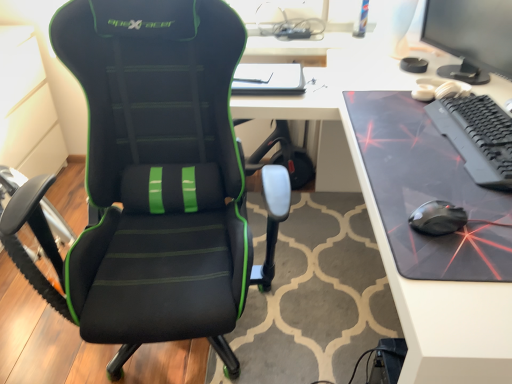
Question: Considering the relative sizes of black matte keyboard at right and black glossy mouse at right in the image provided, is black matte keyboard at right wider than black glossy mouse at right?

Choices:
 (A) yes
 (B) no

Answer: (A)

Question: Does black matte keyboard at right have a lesser height compared to black glossy mouse at right?

Choices:
 (A) no
 (B) yes

Answer: (A)

Question: Does black matte keyboard at right lie behind black glossy mouse at right?

Choices:
 (A) yes
 (B) no

Answer: (A)

Question: Could you tell me if black matte keyboard at right is facing black glossy mouse at right?

Choices:
 (A) yes
 (B) no

Answer: (B)

Question: Is black matte keyboard at right placed right next to black glossy mouse at right?

Choices:
 (A) no
 (B) yes

Answer: (A)

Question: Is black matte keyboard at right in front of or behind matte black monitor at upper right in the image?

Choices:
 (A) front
 (B) behind

Answer: (A)

Question: Is black matte keyboard at right taller or shorter than matte black monitor at upper right?

Choices:
 (A) tall
 (B) short

Answer: (B)

Question: Does point (510, 122) appear closer or farther from the camera than point (463, 18)?

Choices:
 (A) closer
 (B) farther

Answer: (A)

Question: From a real-world perspective, is black matte keyboard at right positioned above or below matte black monitor at upper right?

Choices:
 (A) above
 (B) below

Answer: (B)

Question: Considering their positions, is black leather chair at left located in front of or behind black matte keyboard at right?

Choices:
 (A) behind
 (B) front

Answer: (B)

Question: Based on their sizes in the image, would you say black leather chair at left is bigger or smaller than black matte keyboard at right?

Choices:
 (A) small
 (B) big

Answer: (B)

Question: From the image's perspective, is black leather chair at left above or below black matte keyboard at right?

Choices:
 (A) above
 (B) below

Answer: (B)

Question: In the image, is black leather chair at left on the left side or the right side of black matte keyboard at right?

Choices:
 (A) left
 (B) right

Answer: (A)

Question: In terms of height, does matte black monitor at upper right look taller or shorter compared to black matte keyboard at right?

Choices:
 (A) tall
 (B) short

Answer: (A)

Question: Is point (510, 26) positioned closer to the camera than point (455, 119)?

Choices:
 (A) farther
 (B) closer

Answer: (A)